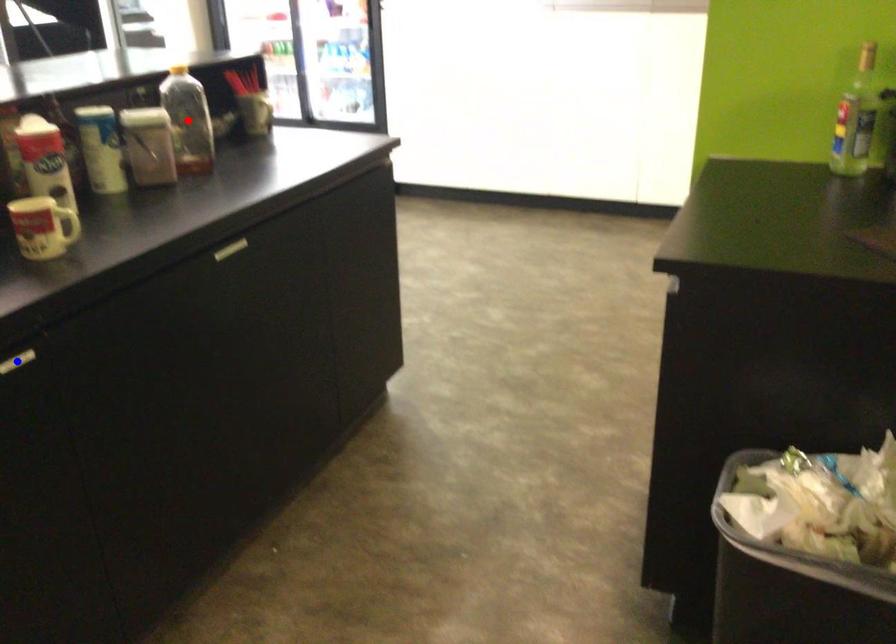
Question: In the image, two points are highlighted. Which point is nearer to the camera? Reply with the corresponding letter.

Choices:
 (A) blue point
 (B) red point

Answer: (A)